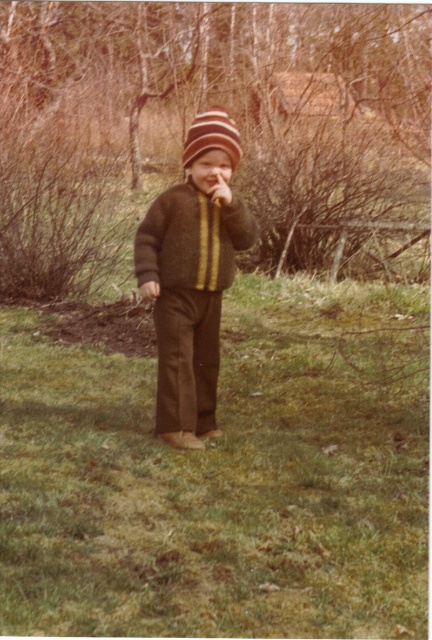
Who is more forward, (225,188) or (212,170)?

Point (225,188) is more forward.

In the scene shown: Is matte brown hand at center bigger than matte brown nose at center?

Correct, matte brown hand at center is larger in size than matte brown nose at center.

The width and height of the screenshot is (432, 640). Describe the element at coordinates (219, 188) in the screenshot. I see `matte brown hand at center` at that location.

Locate an element on the screen. The width and height of the screenshot is (432, 640). matte brown hand at center is located at coordinates (219, 188).

Does knitted brown sweater at center appear on the right side of matte brown hand at center?

In fact, knitted brown sweater at center is to the left of matte brown hand at center.

Between point (187, 304) and point (219, 177), which one is positioned behind?

The point (187, 304) is behind.

The width and height of the screenshot is (432, 640). What are the coordinates of `knitted brown sweater at center` in the screenshot? It's located at (191, 278).

Between point (231, 156) and point (225, 180), which one is positioned in front?

Point (231, 156) is more forward.

How distant is striped woolen hat at center from matte brown hand at center?

They are 8.26 inches apart.

The width and height of the screenshot is (432, 640). What are the coordinates of `striped woolen hat at center` in the screenshot? It's located at (212, 136).